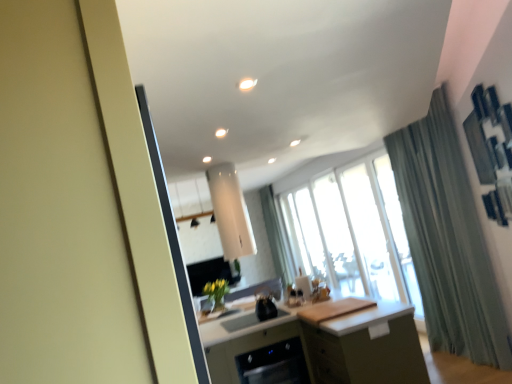
Identify the location of blank area to the left of white glossy light at upper center. (213, 92).